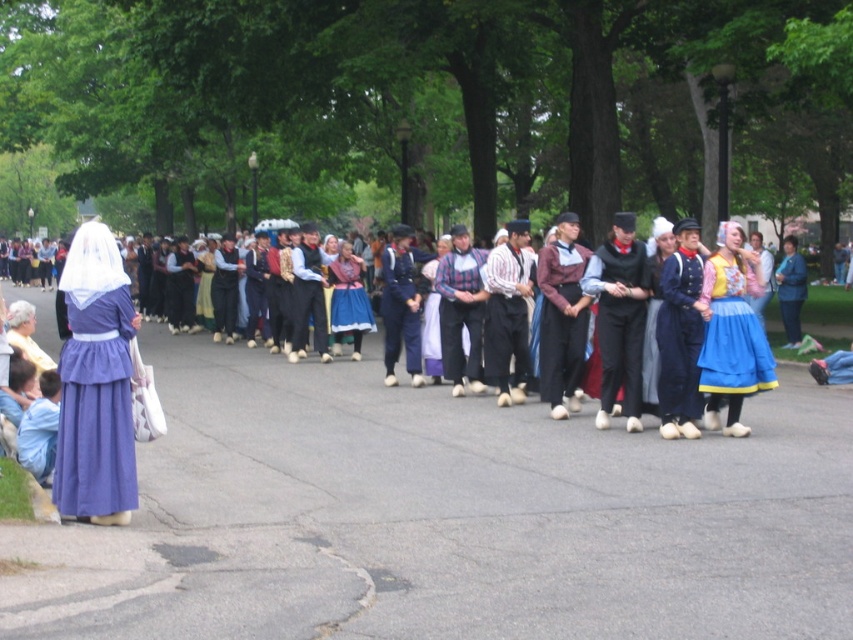
Question: Can you confirm if velvet black vest at center is wider than blue denim pants at center?

Choices:
 (A) yes
 (B) no

Answer: (B)

Question: Which of the following is the farthest from the observer?

Choices:
 (A) blue cotton shirt at center
 (B) matte black suit at center
 (C) blue fabric dress at center
 (D) matte purple dress at left

Answer: (B)

Question: Is velvet black vest at center smaller than blue cotton shirt at center?

Choices:
 (A) yes
 (B) no

Answer: (B)

Question: Which point is closer to the camera?

Choices:
 (A) (358, 280)
 (B) (476, 368)
 (C) (195, 298)

Answer: (B)

Question: Is velvet black vest at center to the left of blue cotton dress at center from the viewer's perspective?

Choices:
 (A) yes
 (B) no

Answer: (B)

Question: Which point is farther to the camera?

Choices:
 (A) maroon fabric shirt at center
 (B) matte black vest at center
 (C) white cotton shirt at center
 (D) blue denim pants at center

Answer: (B)